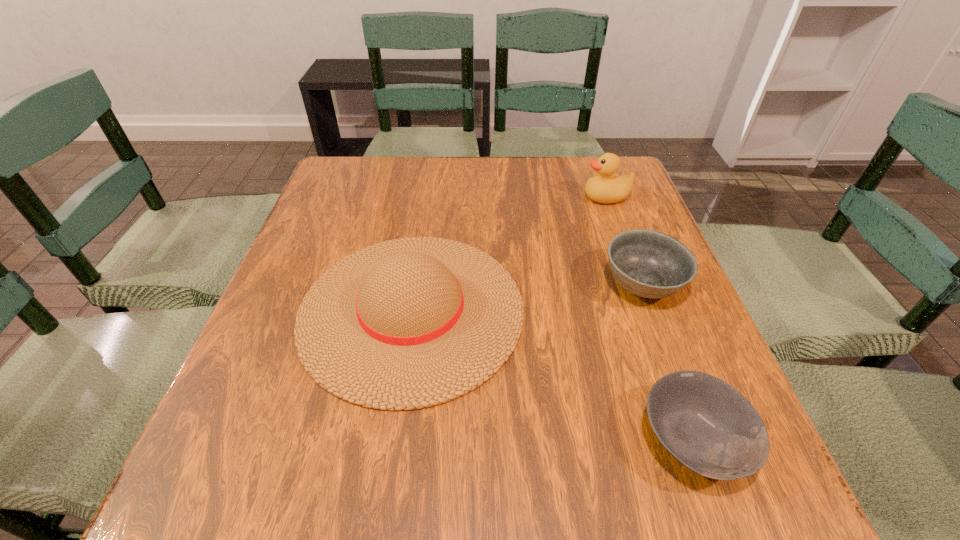
I want to click on the farthest object, so click(603, 187).

The width and height of the screenshot is (960, 540). Identify the location of the leftmost object. (409, 323).

Where is `the third tallest object`? the third tallest object is located at coordinates (650, 264).

I want to click on the taller bowl, so click(x=650, y=264).

At what (x,y) coordinates should I click in order to perform the action: click on the shorter bowl. Please return your answer as a coordinate pair (x, y). This screenshot has width=960, height=540. Looking at the image, I should click on (706, 424).

I want to click on the nearer bowl, so click(706, 424).

The width and height of the screenshot is (960, 540). I want to click on vacant space located 0.210m at the beak of the farthest object, so click(504, 197).

I want to click on free space located 0.370m at the beak of the farthest object, so click(x=444, y=197).

In order to click on vacant region located at the beak of the farthest object in this screenshot , I will do `click(526, 197)`.

The width and height of the screenshot is (960, 540). Find the location of `blank space located on the back of the leftmost object`. blank space located on the back of the leftmost object is located at coordinates (431, 182).